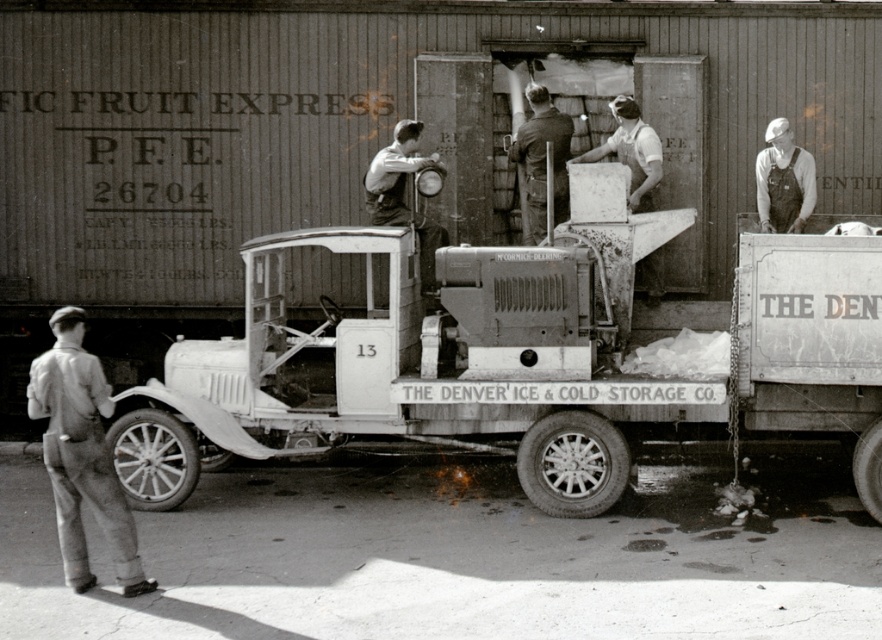
Question: Does light gray overalls at lower left have a lesser width compared to dark brown leather jacket at upper center?

Choices:
 (A) yes
 (B) no

Answer: (B)

Question: Which of the following is the closest to the observer?

Choices:
 (A) (811, 195)
 (B) (154, 582)
 (C) (397, 196)
 (D) (604, 417)

Answer: (B)

Question: Estimate the real-world distances between objects in this image. Which object is closer to the dark brown leather jacket at upper center?

Choices:
 (A) matte black overalls at center
 (B) overalls at center

Answer: (A)

Question: Does light gray overalls at lower left appear under dark brown leather jacket at upper center?

Choices:
 (A) no
 (B) yes

Answer: (B)

Question: Among these objects, which one is nearest to the camera?

Choices:
 (A) light gray overalls at lower left
 (B) metallic white trailer truck at center

Answer: (A)

Question: Does metallic white trailer truck at center come behind matte black overalls at center?

Choices:
 (A) yes
 (B) no

Answer: (B)